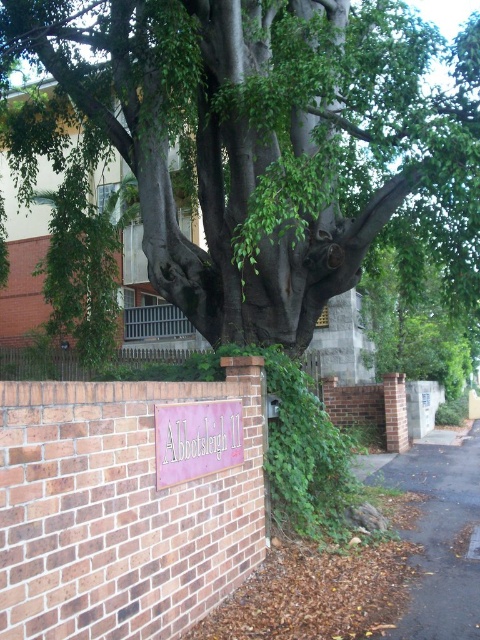
You are a painter standing in front of the green rough bark tree at center and the pink matte sign at center. You want to paint both subjects but have limited canvas space. Which object should you prioritize to fit on the canvas if you can only capture one in full?

The pink matte sign at center should be prioritized because the green rough bark tree at center is wider than the pink matte sign at center, making it harder to fit the entire tree on the canvas.

You are standing in front of the tree and want to walk from point (420, 157) to point (188, 477). Which direction should you move to get closer to your destination?

You should move towards the lower right direction because point (420, 157) is further away from you compared to point (188, 477), so moving towards the lower right will bring you closer to the destination.

You are a painter standing at the base of the green rough bark tree at center. You want to paint both the tree and the pink matte sign at center. Which object will require you to lift your brush higher to capture its top?

The green rough bark tree at center has a greater height compared to the pink matte sign at center, so you will need to lift your brush higher to capture the top of the green rough bark tree at center.